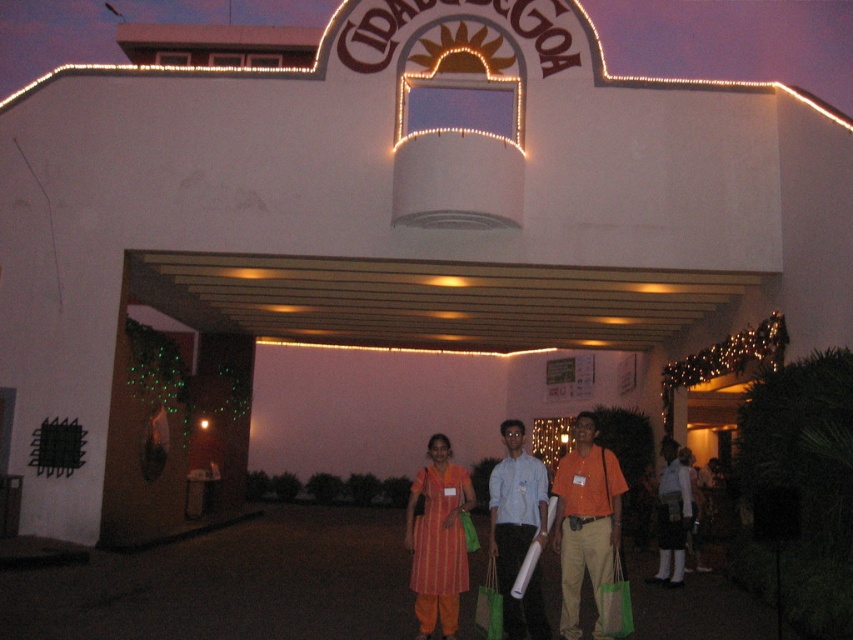
Who is more distant from viewer, (596, 582) or (427, 618)?

The point (596, 582) is more distant.

Is point (581, 429) farther from viewer compared to point (436, 493)?

Yes.

Find the location of a particular element. This screenshot has height=640, width=853. orange cotton shirt at center is located at coordinates (585, 518).

The image size is (853, 640). What do you see at coordinates (672, 515) in the screenshot?
I see `orange striped dress at center` at bounding box center [672, 515].

From the picture: Which is above, orange striped dress at center or green mesh bag at center?

green mesh bag at center is above.

What do you see at coordinates (672, 515) in the screenshot? This screenshot has width=853, height=640. I see `orange striped dress at center` at bounding box center [672, 515].

At what (x,y) coordinates should I click in order to perform the action: click on orange striped dress at center. Please return your answer as a coordinate pair (x, y). This screenshot has width=853, height=640. Looking at the image, I should click on (672, 515).

Is light blue cotton shirt at center smaller than green fabric bag at center?

Incorrect, light blue cotton shirt at center is not smaller in size than green fabric bag at center.

Between point (514, 604) and point (480, 604), which one is positioned behind?

The point (480, 604) is more distant.

Find the location of a particular element. The width and height of the screenshot is (853, 640). light blue cotton shirt at center is located at coordinates (517, 531).